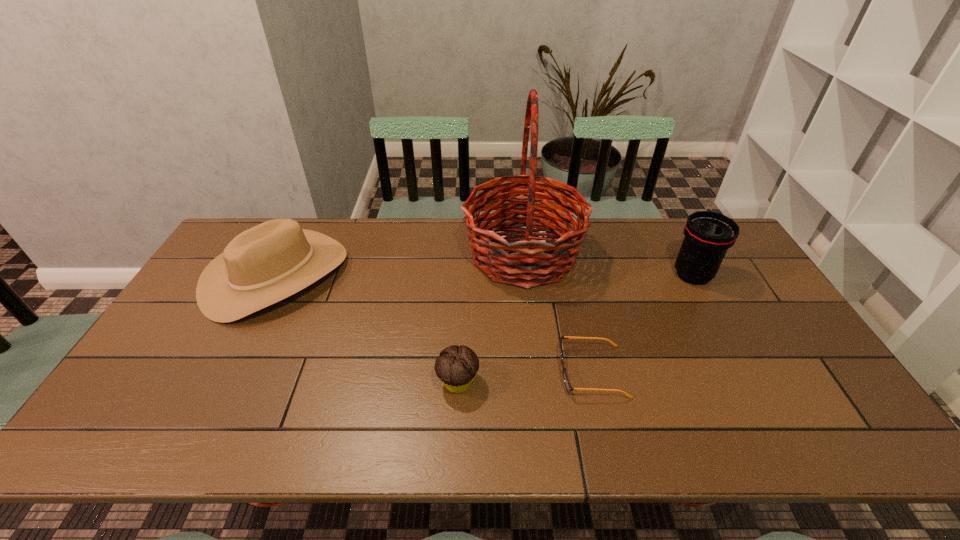
Where is `the tallest object`? The width and height of the screenshot is (960, 540). the tallest object is located at coordinates (513, 262).

At what (x,y) coordinates should I click in order to perform the action: click on telephoto lens. Please return your answer as a coordinate pair (x, y). The height and width of the screenshot is (540, 960). Looking at the image, I should click on (708, 235).

Where is `the third tallest object`? the third tallest object is located at coordinates (267, 263).

The height and width of the screenshot is (540, 960). In order to click on the leftmost object in this screenshot , I will do `click(267, 263)`.

The width and height of the screenshot is (960, 540). I want to click on muffin, so tap(457, 366).

The width and height of the screenshot is (960, 540). What are the coordinates of `the shortest object` in the screenshot? It's located at (568, 387).

Locate an element on the screen. The width and height of the screenshot is (960, 540). vacant space located on the handle side of the basket is located at coordinates (420, 254).

Identify the location of free region located on the handle side of the basket. The height and width of the screenshot is (540, 960). (396, 254).

At what (x,y) coordinates should I click in order to perform the action: click on vacant space located 0.330m on the handle side of the basket. Please return your answer as a coordinate pair (x, y). The width and height of the screenshot is (960, 540). Looking at the image, I should click on (364, 254).

This screenshot has width=960, height=540. I want to click on free space located 0.370m on the front of the rightmost object, so click(757, 395).